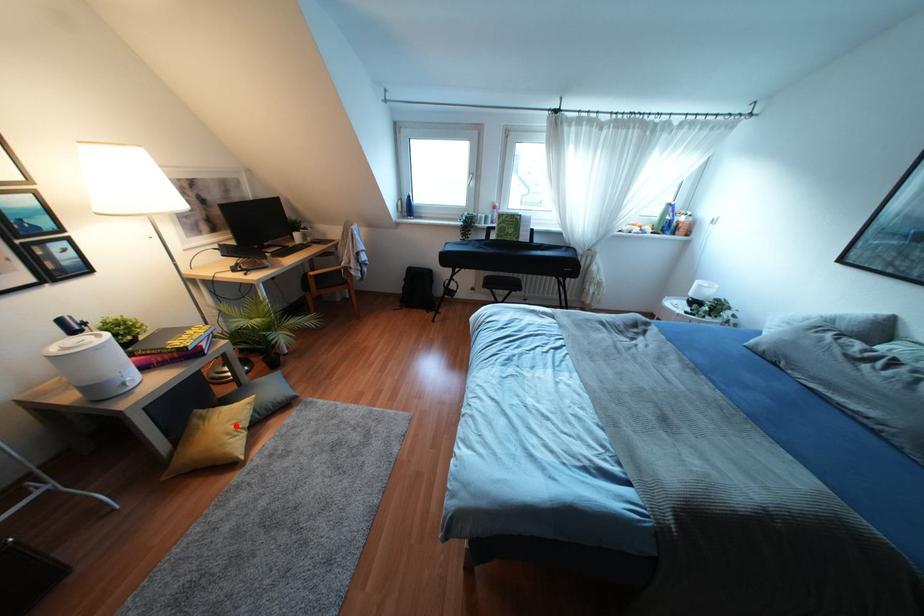
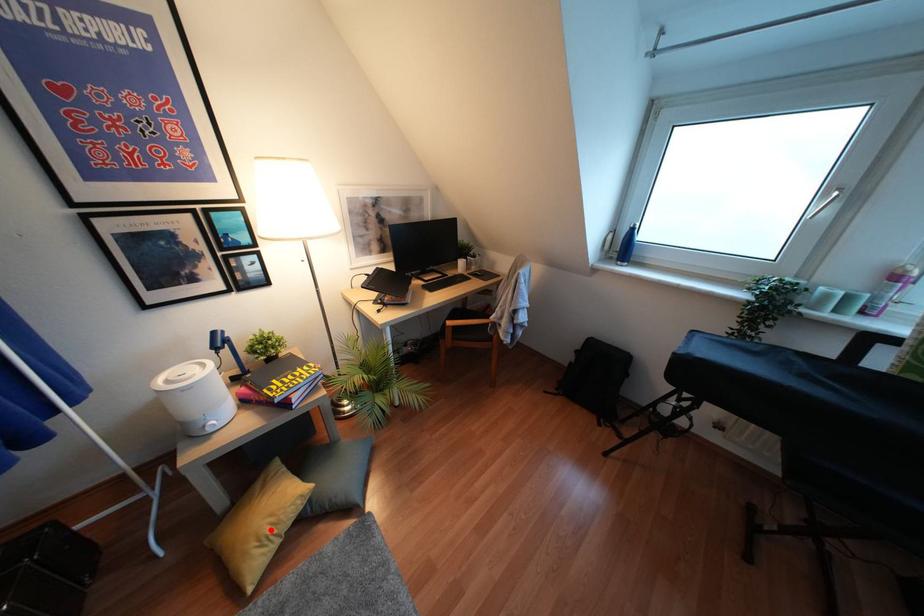
I am providing you with two images of the same scene from different viewpoints. A red point is marked on the first image and another point is marked on the second image. Do the highlighted points in image1 and image2 indicate the same real-world spot?

Yes